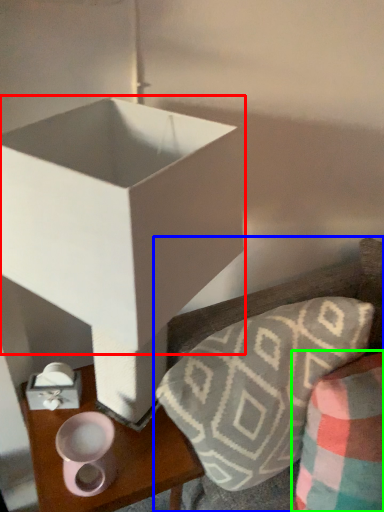
Question: Which object is the farthest from box (highlighted by a red box)? Choose among these: furniture (highlighted by a blue box) or throw pillow (highlighted by a green box).

Choices:
 (A) furniture
 (B) throw pillow

Answer: (B)